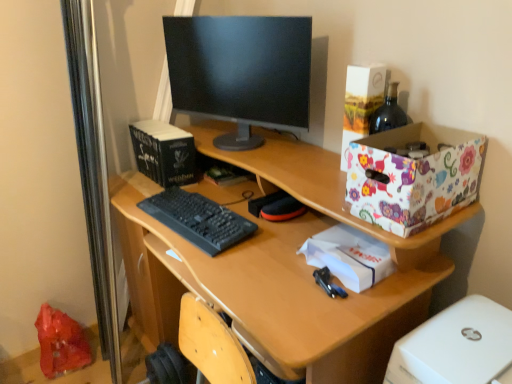
Question: From the image's perspective, is white paper at center under floral-patterned cardboard box at upper right?

Choices:
 (A) yes
 (B) no

Answer: (A)

Question: Is white paper at center not inside floral-patterned cardboard box at upper right?

Choices:
 (A) yes
 (B) no

Answer: (A)

Question: Is white paper at center directly adjacent to floral-patterned cardboard box at upper right?

Choices:
 (A) yes
 (B) no

Answer: (B)

Question: Does white paper at center have a lesser height compared to floral-patterned cardboard box at upper right?

Choices:
 (A) yes
 (B) no

Answer: (A)

Question: Is white paper at center turned away from floral-patterned cardboard box at upper right?

Choices:
 (A) yes
 (B) no

Answer: (B)

Question: Considering the positions of black glossy monitor at center and wooden desk at center in the image, is black glossy monitor at center taller or shorter than wooden desk at center?

Choices:
 (A) short
 (B) tall

Answer: (A)

Question: From the image's perspective, is black glossy monitor at center located above or below wooden desk at center?

Choices:
 (A) below
 (B) above

Answer: (B)

Question: Would you say black glossy monitor at center is inside or outside wooden desk at center?

Choices:
 (A) inside
 (B) outside

Answer: (B)

Question: Is black glossy monitor at center in front of or behind wooden desk at center in the image?

Choices:
 (A) behind
 (B) front

Answer: (A)

Question: Choose the correct answer: Is black matte book at upper left, placed as the 1th book when sorted from left to right, inside black glossy monitor at center or outside it?

Choices:
 (A) inside
 (B) outside

Answer: (B)

Question: From their relative heights in the image, would you say black matte book at upper left, the 2th book viewed from the right, is taller or shorter than black glossy monitor at center?

Choices:
 (A) tall
 (B) short

Answer: (B)

Question: From the image's perspective, is black matte book at upper left, placed as the 1th book when sorted from left to right, positioned above or below black glossy monitor at center?

Choices:
 (A) above
 (B) below

Answer: (B)

Question: Is point (172, 173) closer or farther from the camera than point (250, 102)?

Choices:
 (A) farther
 (B) closer

Answer: (A)

Question: From the image's perspective, relative to floral paper box at upper right, is black matte keyboard at center above or below?

Choices:
 (A) above
 (B) below

Answer: (B)

Question: From their relative heights in the image, would you say black matte keyboard at center is taller or shorter than floral paper box at upper right?

Choices:
 (A) tall
 (B) short

Answer: (B)